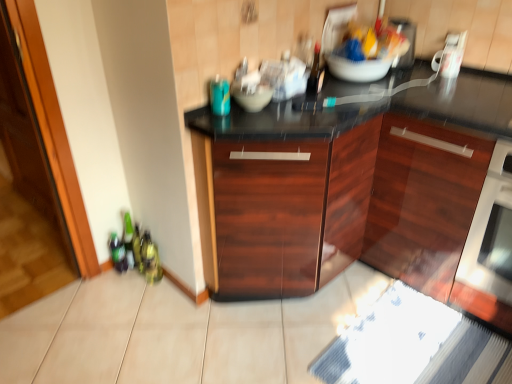
Question: Which direction should I rotate to face mahogany wood cabinet at center, the 1th cabinetry positioned from the left, — up or down?

Choices:
 (A) down
 (B) up

Answer: (A)

Question: Would you say dark wood cabinet at center, placed as the first cabinetry when sorted from right to left, contains matte gray bowl at center?

Choices:
 (A) no
 (B) yes

Answer: (A)

Question: Considering the relative sizes of dark wood cabinet at center, placed as the first cabinetry when sorted from right to left, and matte gray bowl at center in the image provided, is dark wood cabinet at center, placed as the first cabinetry when sorted from right to left, wider than matte gray bowl at center?

Choices:
 (A) no
 (B) yes

Answer: (B)

Question: Is dark wood cabinet at center, acting as the 2th cabinetry starting from the left, not close to matte gray bowl at center?

Choices:
 (A) no
 (B) yes

Answer: (A)

Question: Is dark wood cabinet at center, placed as the first cabinetry when sorted from right to left, smaller than matte gray bowl at center?

Choices:
 (A) yes
 (B) no

Answer: (B)

Question: Is dark wood cabinet at center, acting as the 2th cabinetry starting from the left, bigger than matte gray bowl at center?

Choices:
 (A) yes
 (B) no

Answer: (A)

Question: Could you tell me if dark wood cabinet at center, acting as the 2th cabinetry starting from the left, is facing matte gray bowl at center?

Choices:
 (A) yes
 (B) no

Answer: (B)

Question: Can you confirm if transparent glass door at left is wider than matte gray bowl at center?

Choices:
 (A) no
 (B) yes

Answer: (A)

Question: From a real-world perspective, does transparent glass door at left stand above matte gray bowl at center?

Choices:
 (A) no
 (B) yes

Answer: (A)

Question: Does transparent glass door at left have a smaller size compared to matte gray bowl at center?

Choices:
 (A) no
 (B) yes

Answer: (A)

Question: Does transparent glass door at left turn towards matte gray bowl at center?

Choices:
 (A) no
 (B) yes

Answer: (A)

Question: Can you confirm if transparent glass door at left is shorter than matte gray bowl at center?

Choices:
 (A) yes
 (B) no

Answer: (B)

Question: Can you confirm if transparent glass door at left is bigger than matte gray bowl at center?

Choices:
 (A) no
 (B) yes

Answer: (B)

Question: Is satin white oven at right at the back of mahogany wood cabinet at center, the 1th cabinetry positioned from the left?

Choices:
 (A) no
 (B) yes

Answer: (A)